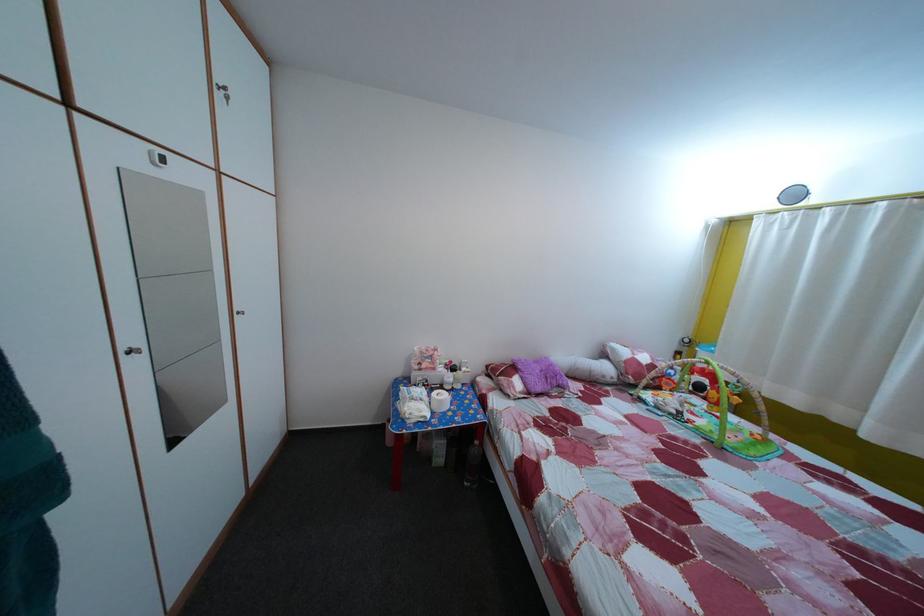
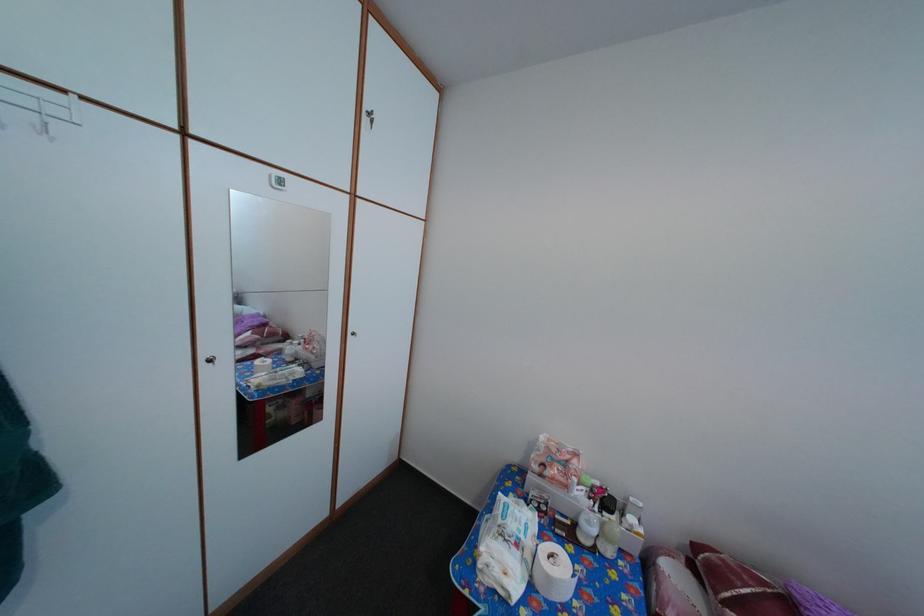
Where in the second image is the point corresponding to (450,408) from the first image?

(558, 586)